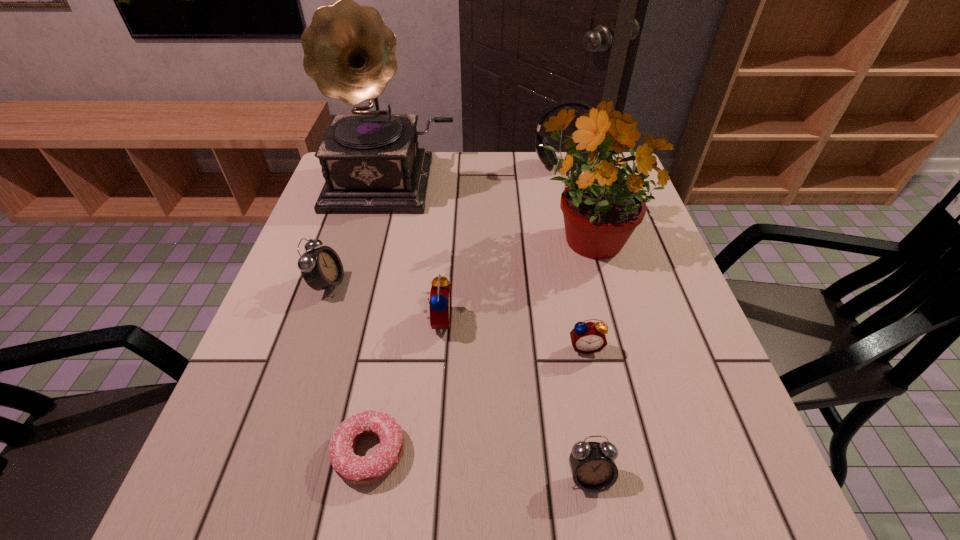
Identify which alarm clock is the third closest to the pink doughnut. Please provide its 2D coordinates. Your answer should be formatted as a tuple, i.e. [(x, y)], where the tuple contains the x and y coordinates of a point satisfying the conditions above.

[(321, 268)]

The height and width of the screenshot is (540, 960). What are the coordinates of `vacant space that satisfies the following two spatial constraints: 1. on the front side of the red flowerpot; 2. on the face of the farthest alarm clock` in the screenshot? It's located at [601, 284].

Where is `vacant space that satisfies the following two spatial constraints: 1. on the ear cups of the sixth shortest object; 2. on the front-facing side of the third alarm clock from right to left`? This screenshot has width=960, height=540. vacant space that satisfies the following two spatial constraints: 1. on the ear cups of the sixth shortest object; 2. on the front-facing side of the third alarm clock from right to left is located at coordinates (602, 321).